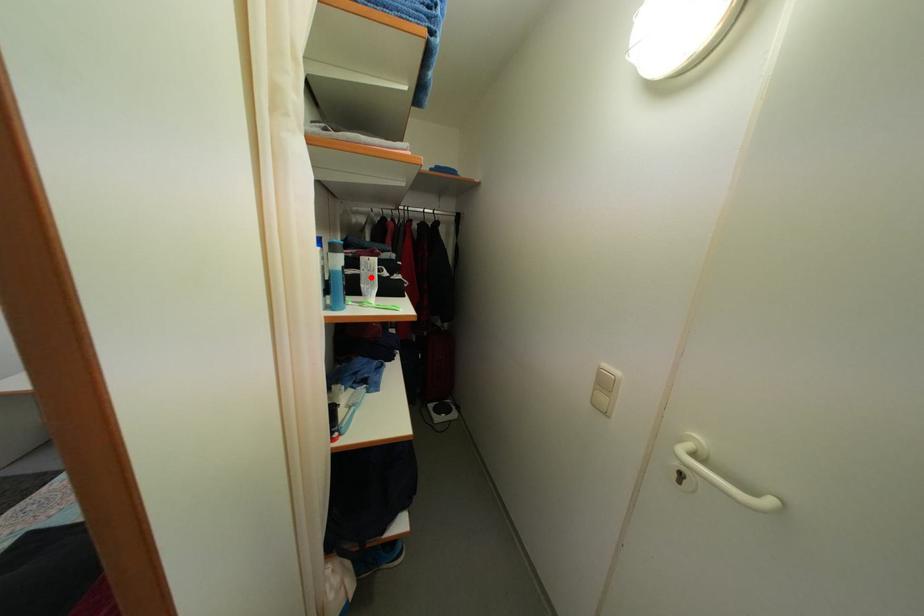
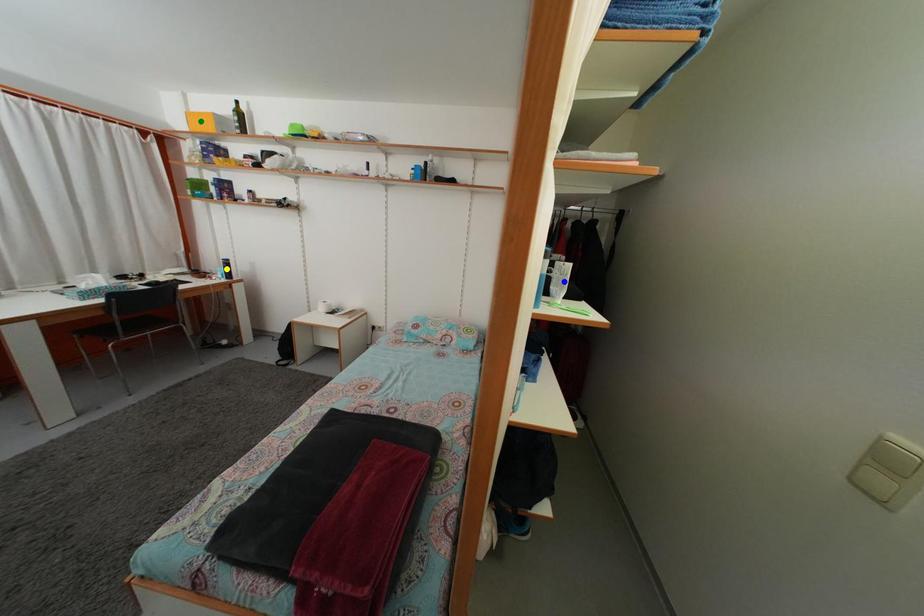
Question: I am providing you with two images of the same scene from different viewpoints. A red point is marked on the first image. You are given multiple points on the second image. Which mark in image 2 goes with the point in image 1?

Choices:
 (A) green point
 (B) yellow point
 (C) blue point

Answer: (C)